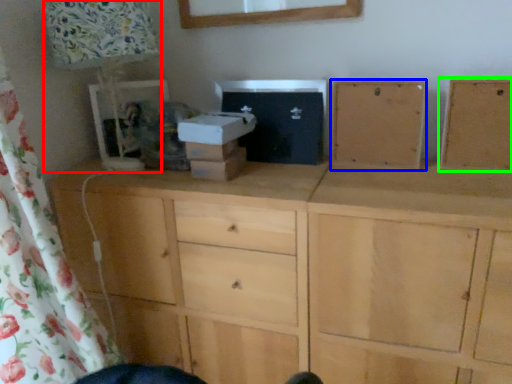
Question: Which object is positioned farthest from table lamp (highlighted by a red box)? Select from cabinetry (highlighted by a blue box) and cabinetry (highlighted by a green box).

Choices:
 (A) cabinetry
 (B) cabinetry

Answer: (B)